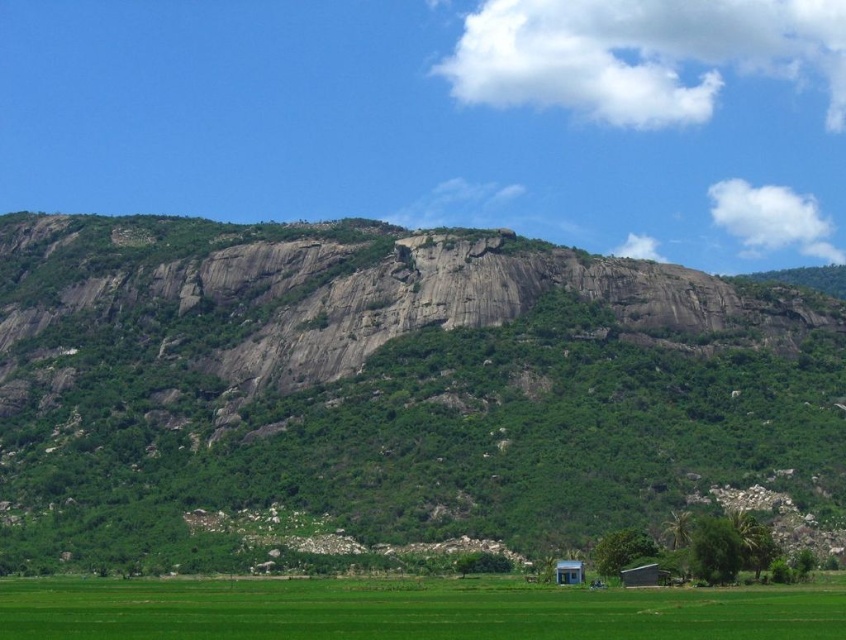
You are standing at the base of the gray rock mountain at center and want to reach the white corrugated metal hut at lower right. Which direction should you walk to avoid the mountain blocking your path?

To reach the white corrugated metal hut at lower right without the gray rock mountain at center blocking your path, you should walk around the mountain to the right side since the hut is behind the mountain and not directly in front of it.

In the scene shown: You are a farmer standing at the edge of the green grass field at lower center and want to reach the white corrugated metal hut at lower right. Which direction should you move to get there?

The green grass field at lower center is below the white corrugated metal hut at lower right, so you should move upward to reach the white corrugated metal hut at lower right from the green grass field at lower center.